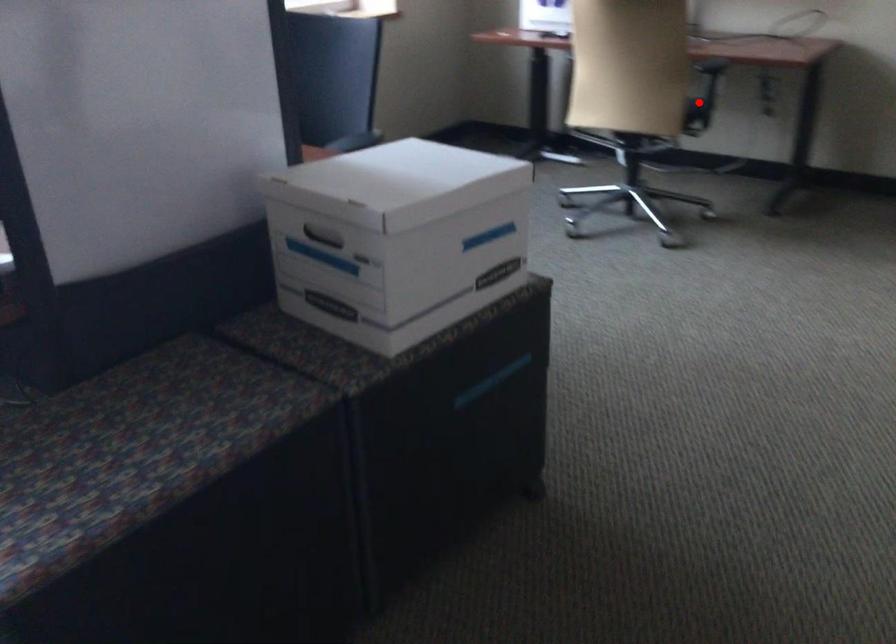
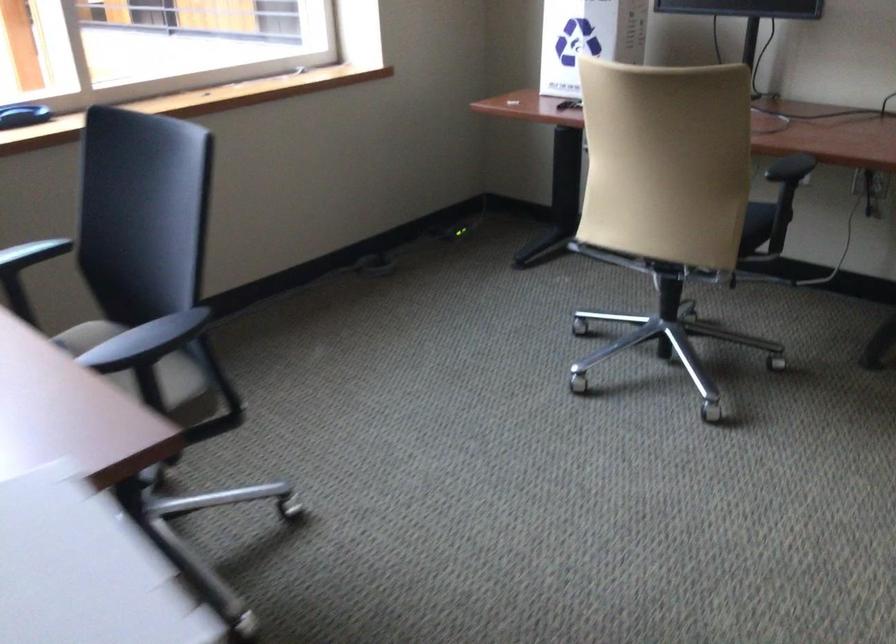
Question: I am providing you with two images of the same scene from different viewpoints. A red point is shown in image1. For the corresponding object point in image2, is it positioned nearer or farther from the camera?

Choices:
 (A) Nearer
 (B) Farther

Answer: (A)